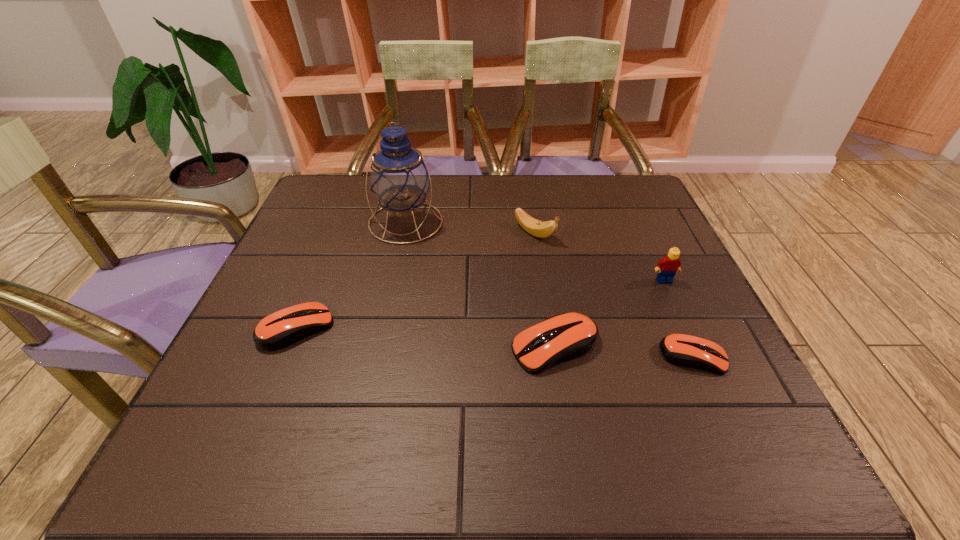
Where is `free space at the far edge of the desktop`? The width and height of the screenshot is (960, 540). free space at the far edge of the desktop is located at coordinates (537, 181).

You are a GUI agent. You are given a task and a screenshot of the screen. Output one action in this format:
    pyautogui.click(x=<x>, y=<y>)
    Task: Click on the vacant region at the near edge of the desktop
    
    Given the screenshot: What is the action you would take?
    coord(455,383)

This screenshot has width=960, height=540. In the image, there is a desktop. Find the location of `free space at the left edge`. free space at the left edge is located at coordinates (260, 354).

This screenshot has height=540, width=960. In the image, there is a desktop. Find the location of `vacant space at the right edge`. vacant space at the right edge is located at coordinates (713, 320).

You are a GUI agent. You are given a task and a screenshot of the screen. Output one action in this format:
    pyautogui.click(x=<x>, y=<y>)
    Task: Click on the vacant area at the far left corner of the desktop
    
    Given the screenshot: What is the action you would take?
    pyautogui.click(x=348, y=212)

Identify the location of free space at the far right corner of the desktop. The width and height of the screenshot is (960, 540). (651, 202).

Find the location of `unoccupied area between the second computer mouse from right to left and the leftmost computer mouse`. unoccupied area between the second computer mouse from right to left and the leftmost computer mouse is located at coordinates (426, 338).

Identify the location of vacant area that lies between the leftmost object and the banana. This screenshot has width=960, height=540. (416, 281).

Identify the location of free spot between the shortest object and the banana. (613, 295).

Identify the location of vacant region between the second shortest object and the banana. The image size is (960, 540). click(x=416, y=281).